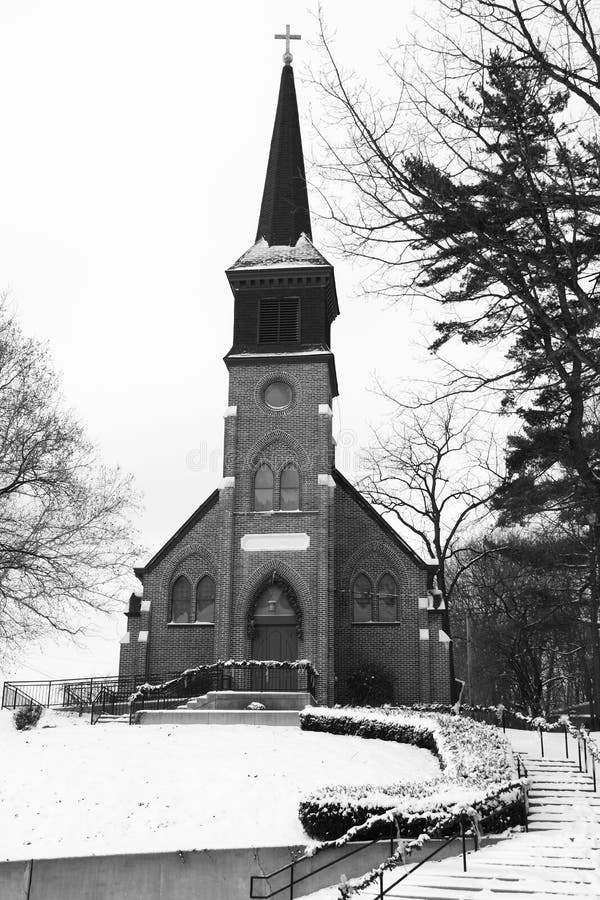
Where is `windows`? windows is located at coordinates pyautogui.click(x=211, y=616), pyautogui.click(x=356, y=615).